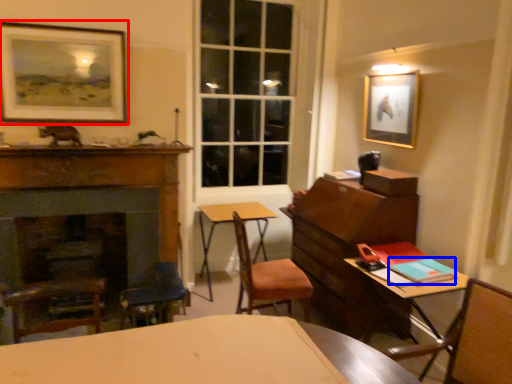
Question: Which point is closer to the camera, picture frame (highlighted by a red box) or book (highlighted by a blue box)?

Choices:
 (A) picture frame
 (B) book

Answer: (B)